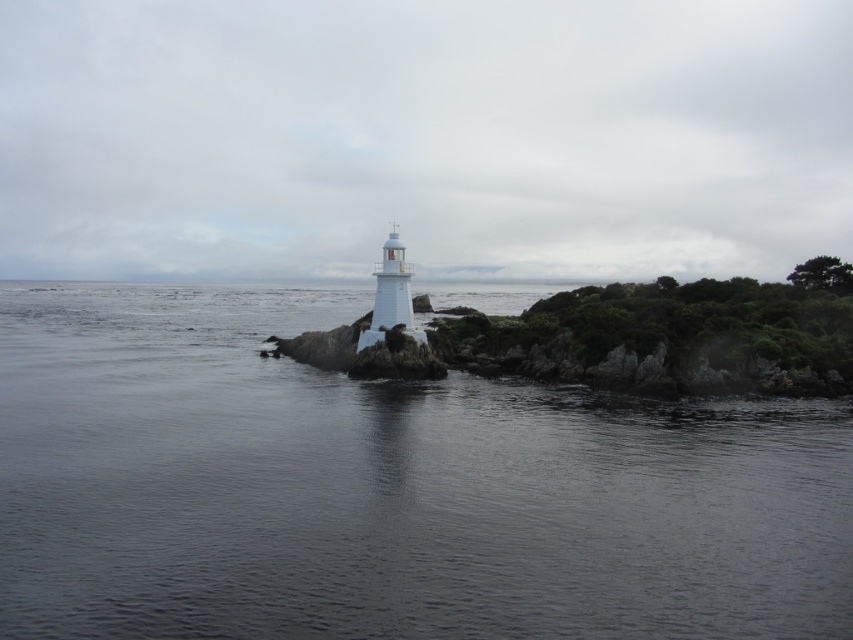
How distant is transparent water at center from white glossy lighthouse at center?

transparent water at center and white glossy lighthouse at center are 14.58 meters apart.

Does transparent water at center have a larger size compared to white glossy lighthouse at center?

Yes, transparent water at center is bigger than white glossy lighthouse at center.

Locate an element on the screen. transparent water at center is located at coordinates (386, 488).